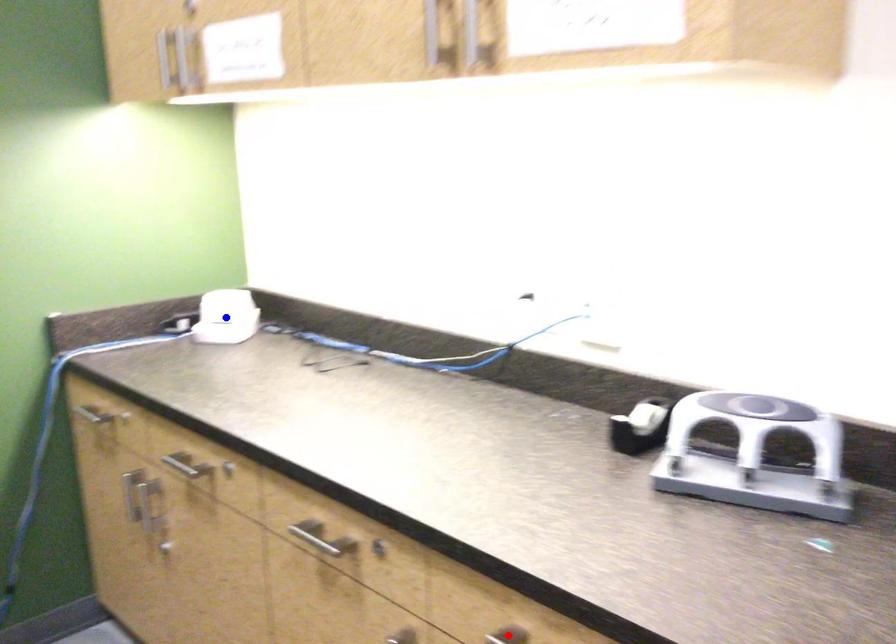
Question: In the image, two points are highlighted. Which point is nearer to the camera? Reply with the corresponding letter.

Choices:
 (A) blue point
 (B) red point

Answer: (B)